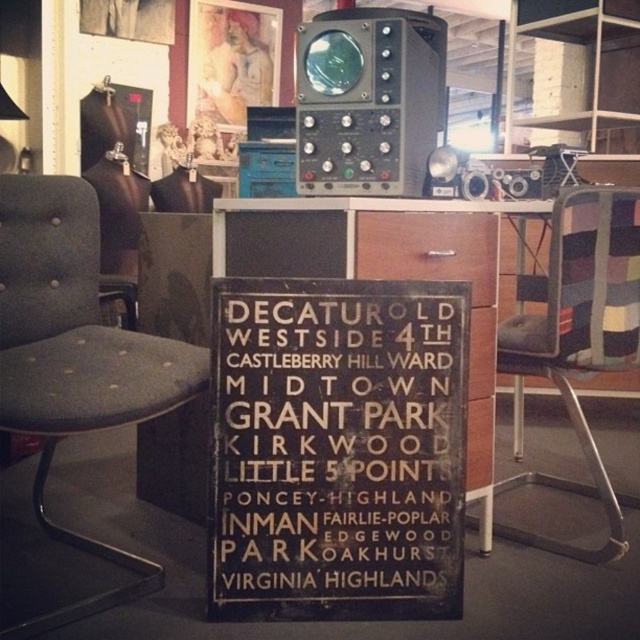
Question: Is dark gray fabric swivel chair at left thinner than striped fabric swivel chair at right?

Choices:
 (A) no
 (B) yes

Answer: (A)

Question: Which of the following is the closest to the observer?

Choices:
 (A) brown wood sign at center
 (B) dark gray fabric swivel chair at left
 (C) striped fabric swivel chair at right

Answer: (B)

Question: Among these points, which one is nearest to the camera?

Choices:
 (A) (301, 529)
 (B) (8, 180)

Answer: (A)

Question: Does brown wood sign at center appear on the right side of striped fabric swivel chair at right?

Choices:
 (A) yes
 (B) no

Answer: (B)

Question: Is dark gray fabric swivel chair at left to the left of striped fabric swivel chair at right from the viewer's perspective?

Choices:
 (A) no
 (B) yes

Answer: (B)

Question: Which of the following is the closest to the observer?

Choices:
 (A) (221, 294)
 (B) (76, 532)

Answer: (A)